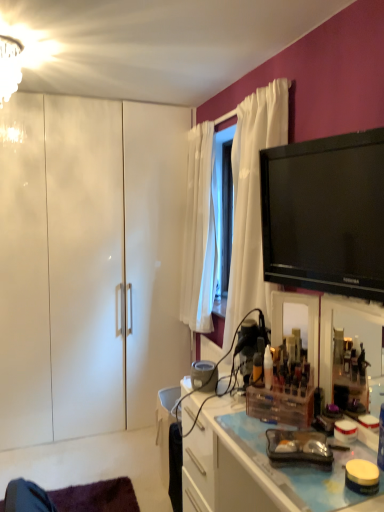
Question: Are clear plastic organizer at center, which ranks as the 2th cabinetry in back-to-front order, and white glass chandelier at upper left making contact?

Choices:
 (A) yes
 (B) no

Answer: (B)

Question: Does clear plastic organizer at center, the first cabinetry when ordered from front to back, have a larger size compared to white glass chandelier at upper left?

Choices:
 (A) yes
 (B) no

Answer: (A)

Question: From the image's perspective, does clear plastic organizer at center, the first cabinetry when ordered from front to back, appear higher than white glass chandelier at upper left?

Choices:
 (A) no
 (B) yes

Answer: (A)

Question: Is clear plastic organizer at center, which is the 1th cabinetry from right to left, located outside white glass chandelier at upper left?

Choices:
 (A) no
 (B) yes

Answer: (B)

Question: From a real-world perspective, is clear plastic organizer at center, the first cabinetry when ordered from front to back, physically below white glass chandelier at upper left?

Choices:
 (A) yes
 (B) no

Answer: (A)

Question: From a real-world perspective, is white glass chandelier at upper left above or below clear plastic organizer at center, the first cabinetry when ordered from front to back?

Choices:
 (A) above
 (B) below

Answer: (A)

Question: In terms of size, does white glass chandelier at upper left appear bigger or smaller than clear plastic organizer at center, the first cabinetry when ordered from front to back?

Choices:
 (A) small
 (B) big

Answer: (A)

Question: In terms of width, does white glass chandelier at upper left look wider or thinner when compared to clear plastic organizer at center, which is the 1th cabinetry from right to left?

Choices:
 (A) thin
 (B) wide

Answer: (A)

Question: Does point (16, 47) appear closer or farther from the camera than point (256, 482)?

Choices:
 (A) farther
 (B) closer

Answer: (A)

Question: Visually, is white glossy cabinet at left, the 2th cabinetry from the right, positioned to the left or to the right of white glass chandelier at upper left?

Choices:
 (A) right
 (B) left

Answer: (A)

Question: Considering the positions of white glossy cabinet at left, the 1th cabinetry when ordered from left to right, and white glass chandelier at upper left in the image, is white glossy cabinet at left, the 1th cabinetry when ordered from left to right, bigger or smaller than white glass chandelier at upper left?

Choices:
 (A) small
 (B) big

Answer: (B)

Question: From a real-world perspective, is white glossy cabinet at left, the 2th cabinetry from the right, positioned above or below white glass chandelier at upper left?

Choices:
 (A) above
 (B) below

Answer: (B)

Question: Is white glossy cabinet at left, the 1th cabinetry when ordered from left to right, taller or shorter than white glass chandelier at upper left?

Choices:
 (A) tall
 (B) short

Answer: (A)

Question: From the image's perspective, is black glossy tv at upper right positioned above or below white glossy cabinet at left, the 2th cabinetry from the right?

Choices:
 (A) below
 (B) above

Answer: (B)

Question: Does point (379, 143) appear closer or farther from the camera than point (31, 242)?

Choices:
 (A) closer
 (B) farther

Answer: (A)